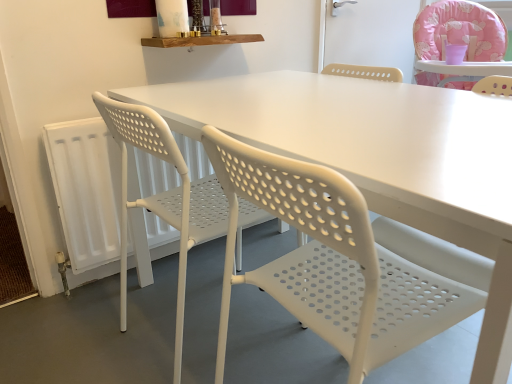
Question: From the image's perspective, is white perforated plastic chair at left, marked as the first chair in a left-to-right arrangement, located above or below white plastic radiator at lower left?

Choices:
 (A) below
 (B) above

Answer: (A)

Question: Considering the positions of point (205, 203) and point (69, 180), is point (205, 203) closer or farther from the camera than point (69, 180)?

Choices:
 (A) farther
 (B) closer

Answer: (B)

Question: Which is farther from the pink fabric highchair at upper right, the first chair viewed from the right?

Choices:
 (A) white plastic radiator at lower left
 (B) white perforated plastic chair at center, positioned as the 2th chair in right-to-left order
 (C) white perforated plastic chair at left, marked as the first chair in a left-to-right arrangement

Answer: (B)

Question: Considering the real-world distances, which object is closest to the white perforated plastic chair at left, marked as the first chair in a left-to-right arrangement?

Choices:
 (A) white plastic radiator at lower left
 (B) white perforated plastic chair at center, which is the second chair from left to right
 (C) pink fabric highchair at upper right, the first chair viewed from the right

Answer: (A)